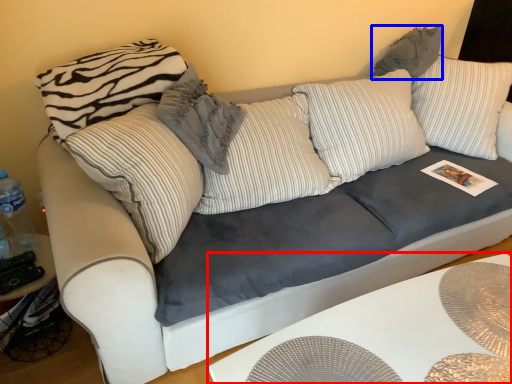
Question: Which object appears closest to the camera in this image, table (highlighted by a red box) or pillow (highlighted by a blue box)?

Choices:
 (A) table
 (B) pillow

Answer: (A)